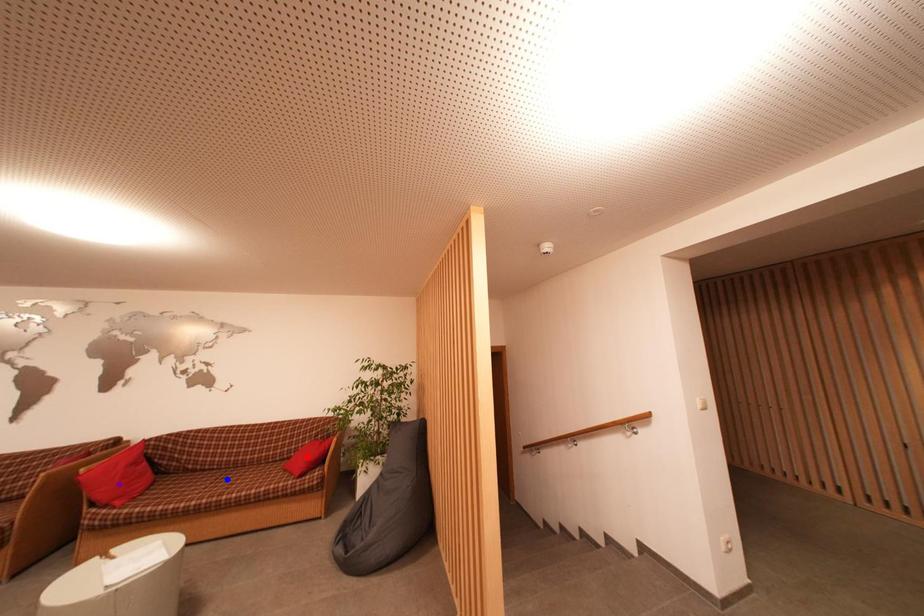
Order these from farthest to nearest:
purple point, blue point, red point

red point → blue point → purple point